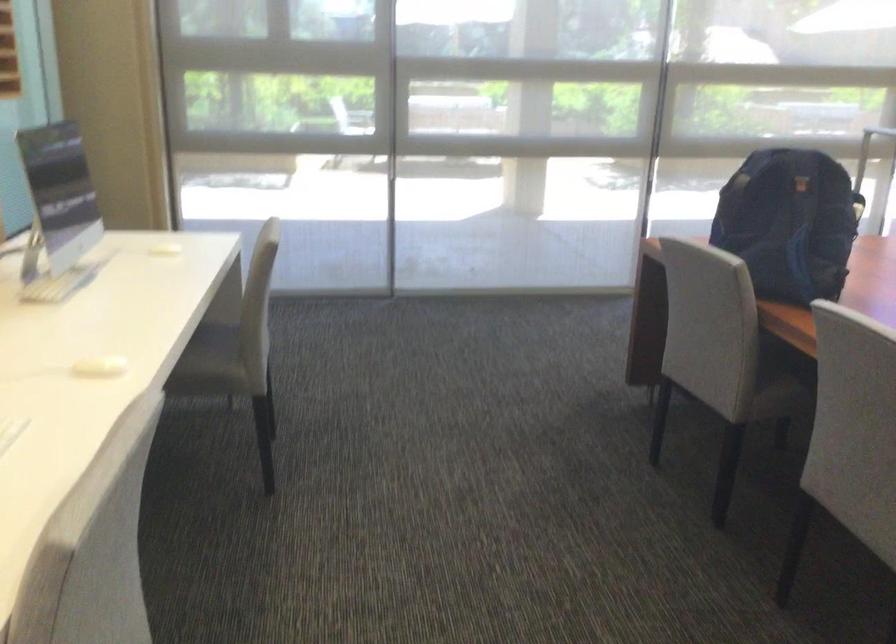
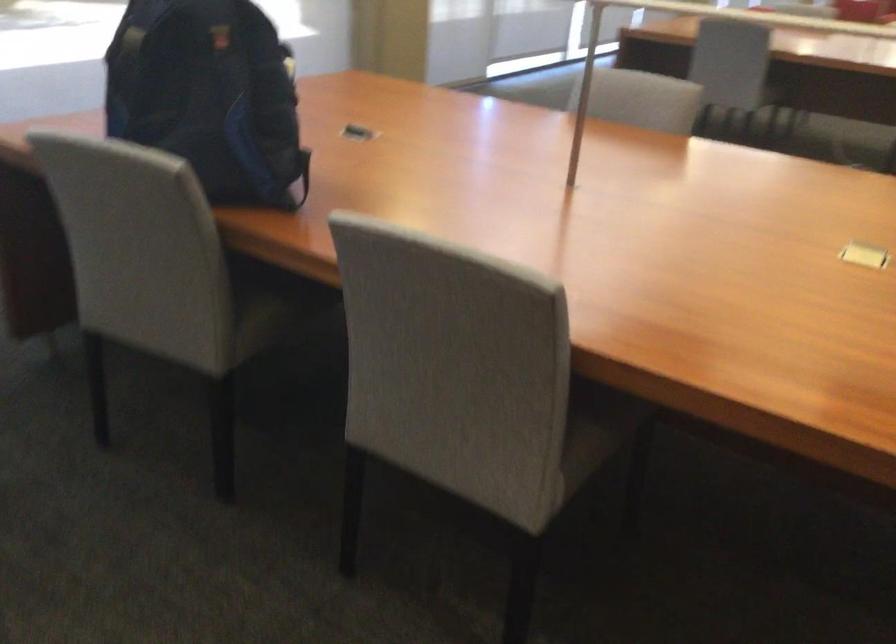
How did the camera likely rotate?

The camera rotated toward right-down.